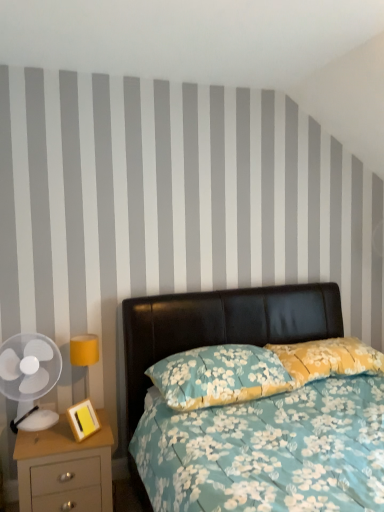
This screenshot has width=384, height=512. Describe the element at coordinates (215, 327) in the screenshot. I see `floral fabric bed at center` at that location.

At what (x,y) coordinates should I click in order to perform the action: click on transparent plastic fan at left. Please return your answer as a coordinate pair (x, y). This screenshot has width=384, height=512. Looking at the image, I should click on (24, 370).

What do you see at coordinates (24, 370) in the screenshot?
I see `transparent plastic fan at left` at bounding box center [24, 370].

The image size is (384, 512). What do you see at coordinates (65, 469) in the screenshot?
I see `beige wood nightstand at lower left` at bounding box center [65, 469].

The height and width of the screenshot is (512, 384). Identify the location of floral fabric bed at center. (215, 327).

Does floral fabric bed at center have a larger size compared to floral fabric pillow at center, the second pillow from the left?

Yes.

Can you confirm if floral fabric bed at center is positioned to the left of floral fabric pillow at center, the second pillow from the left?

Correct, you'll find floral fabric bed at center to the left of floral fabric pillow at center, the second pillow from the left.

Between floral fabric bed at center and floral fabric pillow at center, the second pillow from the left, which one has more height?

Standing taller between the two is floral fabric bed at center.

From the picture: Which object is further away from the camera taking this photo, floral fabric bed at center or floral fabric pillow at center, the second pillow from the left?

floral fabric pillow at center, the second pillow from the left.

Does floral fabric pillow at center, the first pillow viewed from the right, come behind floral fabric bed at center?

Yes, floral fabric pillow at center, the first pillow viewed from the right, is further from the viewer.

Considering the sizes of floral fabric pillow at center, the first pillow viewed from the right, and floral fabric bed at center in the image, is floral fabric pillow at center, the first pillow viewed from the right, bigger or smaller than floral fabric bed at center?

In the image, floral fabric pillow at center, the first pillow viewed from the right, appears to be smaller than floral fabric bed at center.

Consider the image. Is floral fabric pillow at center, the first pillow viewed from the right, wider or thinner than floral fabric bed at center?

floral fabric pillow at center, the first pillow viewed from the right, is thinner than floral fabric bed at center.

Considering the relative positions of matte yellow lampshade at left and beige wood nightstand at lower left in the image provided, is matte yellow lampshade at left in front of beige wood nightstand at lower left?

That is False.

Can you confirm if matte yellow lampshade at left is positioned to the right of beige wood nightstand at lower left?

Correct, you'll find matte yellow lampshade at left to the right of beige wood nightstand at lower left.

Which of these two, matte yellow lampshade at left or beige wood nightstand at lower left, is thinner?

matte yellow lampshade at left is thinner.

Does point (85, 350) come farther from viewer compared to point (18, 447)?

Yes, point (85, 350) is behind point (18, 447).

Is wooden/yellow picture frame at lower left closer to camera compared to floral fabric pillow at center, placed as the 2th pillow when sorted from right to left?

No, it is not.

Is wooden/yellow picture frame at lower left taller or shorter than floral fabric pillow at center, placed as the 2th pillow when sorted from right to left?

Considering their sizes, wooden/yellow picture frame at lower left has less height than floral fabric pillow at center, placed as the 2th pillow when sorted from right to left.

Is wooden/yellow picture frame at lower left wider or thinner than floral fabric pillow at center, which is the first pillow from left to right?

Clearly, wooden/yellow picture frame at lower left has less width compared to floral fabric pillow at center, which is the first pillow from left to right.

Is beige wood nightstand at lower left located outside matte yellow lampshade at left?

beige wood nightstand at lower left lies outside matte yellow lampshade at left's area.

From a real-world perspective, which object rests below the other?

beige wood nightstand at lower left, from a real-world perspective.

From the image's perspective, is beige wood nightstand at lower left located above or below matte yellow lampshade at left?

Based on their image positions, beige wood nightstand at lower left is located beneath matte yellow lampshade at left.

Looking at this image, can you tell me how much beige wood nightstand at lower left and floral fabric bed at center differ in facing direction?

They differ by 3.47 degrees in their facing directions.

Does beige wood nightstand at lower left turn towards floral fabric bed at center?

No, beige wood nightstand at lower left is not turned towards floral fabric bed at center.

Between beige wood nightstand at lower left and floral fabric bed at center, which one appears on the right side from the viewer's perspective?

floral fabric bed at center.

Which of these two, beige wood nightstand at lower left or floral fabric bed at center, is bigger?

floral fabric bed at center.

Is beige wood nightstand at lower left placed right next to transparent plastic fan at left?

beige wood nightstand at lower left and transparent plastic fan at left are clearly separated.

Between beige wood nightstand at lower left and transparent plastic fan at left, which one appears on the right side from the viewer's perspective?

beige wood nightstand at lower left is more to the right.

Which is in front, point (110, 433) or point (10, 353)?

Positioned in front is point (110, 433).

Does beige wood nightstand at lower left have a greater width compared to transparent plastic fan at left?

Yes, beige wood nightstand at lower left is wider than transparent plastic fan at left.

Where is `the 2nd pillow located above the floral fabric bed at center (from a real-world perspective)`? The height and width of the screenshot is (512, 384). the 2nd pillow located above the floral fabric bed at center (from a real-world perspective) is located at coordinates (327, 359).

Where is `bed that is in front of the floral fabric pillow at center, the second pillow from the left`? bed that is in front of the floral fabric pillow at center, the second pillow from the left is located at coordinates (215, 327).

From the image, which object appears to be farther from transparent plastic fan at left, floral fabric bed at center or wooden/yellow picture frame at lower left?

The object further to transparent plastic fan at left is floral fabric bed at center.

Looking at the image, which one is located further to transparent plastic fan at left, floral fabric pillow at center, the second pillow from the left, or matte yellow lampshade at left?

floral fabric pillow at center, the second pillow from the left, lies further to transparent plastic fan at left than the other object.

Based on their spatial positions, is beige wood nightstand at lower left or floral fabric bed at center closer to wooden/yellow picture frame at lower left?

beige wood nightstand at lower left is positioned closer to the anchor wooden/yellow picture frame at lower left.

Estimate the real-world distances between objects in this image. Which object is closer to beige wood nightstand at lower left, wooden/yellow picture frame at lower left or matte yellow lampshade at left?

wooden/yellow picture frame at lower left lies closer to beige wood nightstand at lower left than the other object.

Considering their positions, is beige wood nightstand at lower left positioned closer to floral fabric pillow at center, which is the first pillow from left to right, than floral fabric pillow at center, the first pillow viewed from the right?

floral fabric pillow at center, the first pillow viewed from the right.

Which object lies further to the anchor point transparent plastic fan at left, floral fabric pillow at center, placed as the 2th pillow when sorted from right to left, or matte yellow lampshade at left?

Among the two, floral fabric pillow at center, placed as the 2th pillow when sorted from right to left, is located further to transparent plastic fan at left.

Looking at the image, which one is located closer to floral fabric pillow at center, the second pillow from the left, transparent plastic fan at left or floral fabric pillow at center, which is the first pillow from left to right?

floral fabric pillow at center, which is the first pillow from left to right, is positioned closer to the anchor floral fabric pillow at center, the second pillow from the left.

Looking at the image, which one is located closer to floral fabric pillow at center, placed as the 2th pillow when sorted from right to left, matte yellow lampshade at left or beige wood nightstand at lower left?

The object closer to floral fabric pillow at center, placed as the 2th pillow when sorted from right to left, is beige wood nightstand at lower left.

This screenshot has width=384, height=512. I want to click on bedside lamp situated between transparent plastic fan at left and floral fabric pillow at center, placed as the 2th pillow when sorted from right to left, from left to right, so click(84, 355).

The width and height of the screenshot is (384, 512). Identify the location of picture frame between transparent plastic fan at left and beige wood nightstand at lower left in the up-down direction. (83, 420).

Where is `pillow between beige wood nightstand at lower left and floral fabric pillow at center, the second pillow from the left, in the horizontal direction`? The image size is (384, 512). pillow between beige wood nightstand at lower left and floral fabric pillow at center, the second pillow from the left, in the horizontal direction is located at coordinates click(x=219, y=376).

What are the coordinates of `picture frame situated between matte yellow lampshade at left and floral fabric pillow at center, which is the first pillow from left to right, from left to right` in the screenshot? It's located at (83, 420).